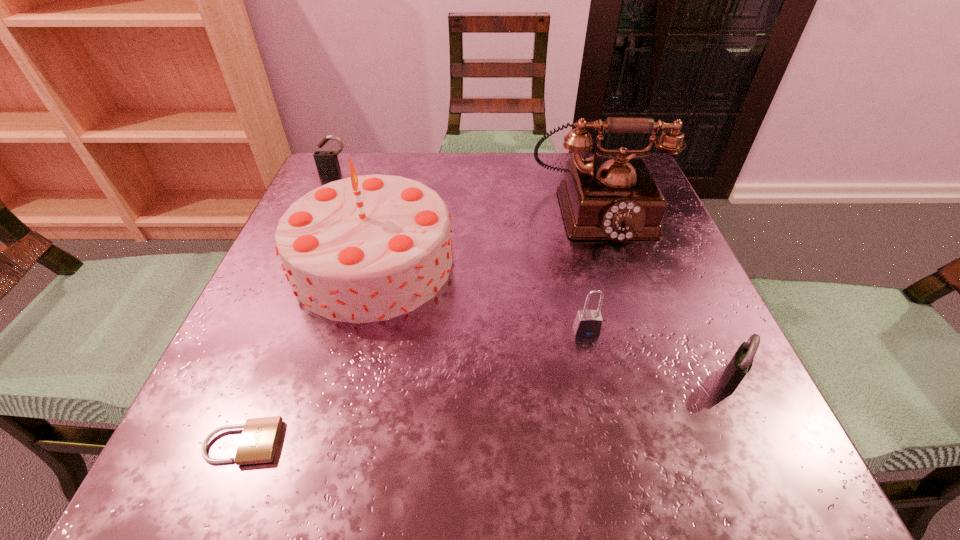
In order to click on vacant space situated 0.170m with the keyhole on the front of the farthest object in this screenshot , I will do `click(313, 218)`.

Find the location of a particular element. The height and width of the screenshot is (540, 960). free space located 0.060m on the shackle of the second farthest padlock is located at coordinates (595, 370).

Locate an element on the screen. Image resolution: width=960 pixels, height=540 pixels. vacant space located on the left of the third farthest padlock is located at coordinates 457,377.

Find the location of `free location located 0.060m on the right of the shortest object`. free location located 0.060m on the right of the shortest object is located at coordinates (327, 443).

Image resolution: width=960 pixels, height=540 pixels. In order to click on telephone present at the far edge in this screenshot , I will do `click(617, 199)`.

The height and width of the screenshot is (540, 960). I want to click on padlock at the far edge, so click(326, 161).

Where is `object that is at the near edge`? The height and width of the screenshot is (540, 960). object that is at the near edge is located at coordinates (259, 439).

I want to click on birthday cake at the left edge, so click(368, 248).

The image size is (960, 540). I want to click on telephone that is positioned at the right edge, so click(617, 199).

Identify the location of padlock situated at the right edge. coord(739,366).